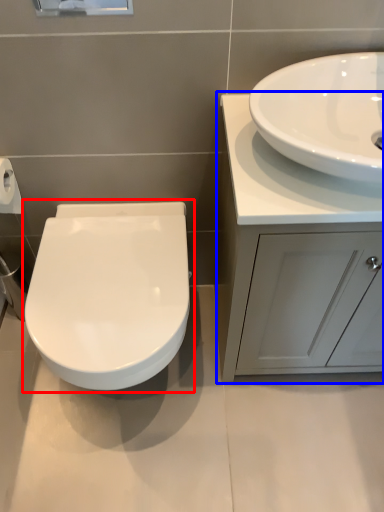
Question: Which of the following is the closest to the observer, toilet (highlighted by a red box) or bathroom cabinet (highlighted by a blue box)?

Choices:
 (A) toilet
 (B) bathroom cabinet

Answer: (B)